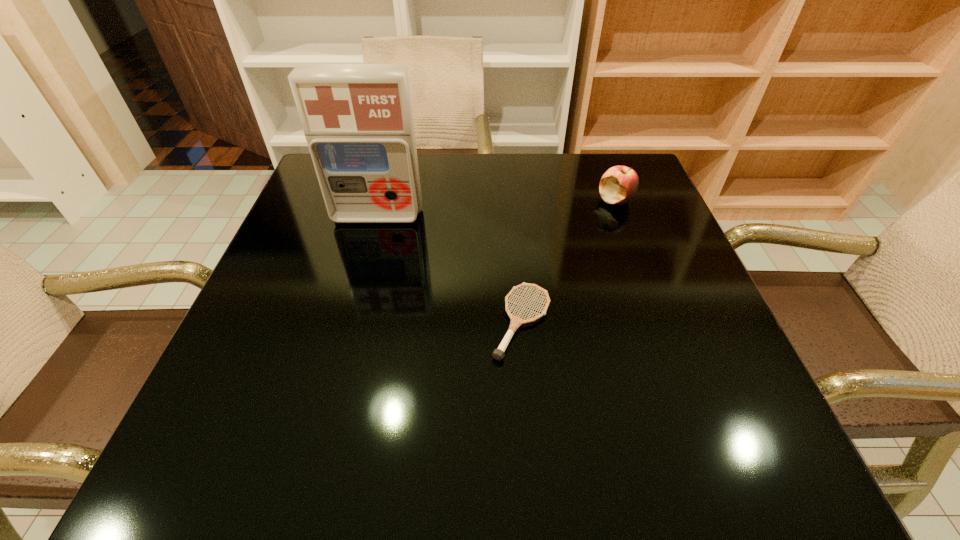
I want to click on the leftmost object, so click(357, 119).

The width and height of the screenshot is (960, 540). In order to click on the first-aid kit in this screenshot , I will do `click(357, 119)`.

Where is `the rightmost object`? The width and height of the screenshot is (960, 540). the rightmost object is located at coordinates (618, 185).

At what (x,y) coordinates should I click in order to perform the action: click on apple. Please return your answer as a coordinate pair (x, y). Looking at the image, I should click on (618, 185).

Where is `the shortest object`? the shortest object is located at coordinates [x=498, y=354].

Image resolution: width=960 pixels, height=540 pixels. I want to click on tennis racket, so click(x=498, y=354).

This screenshot has height=540, width=960. I want to click on vacant region located 0.340m on the front-facing side of the first-aid kit, so click(342, 346).

The image size is (960, 540). What are the coordinates of `blank space located on the front of the rightmost object` in the screenshot? It's located at (659, 318).

Locate an element on the screen. The height and width of the screenshot is (540, 960). vacant space situated on the back of the tennis racket is located at coordinates (516, 253).

Locate an element on the screen. object that is positioned at the far edge is located at coordinates (618, 185).